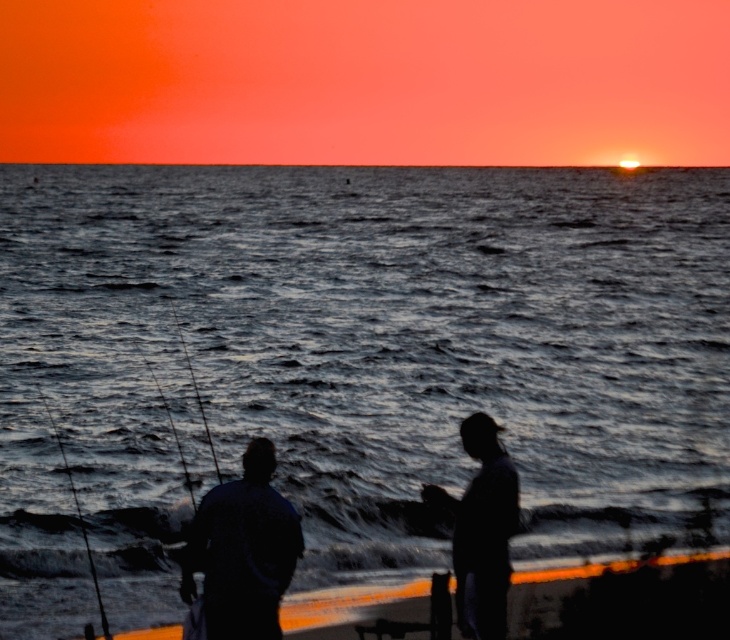
You are a photographer trying to capture the two fishing rods in the scene. Which of the two rods, the smooth black rod at left or the metallic fishing pole at left, appears closer to you?

The smooth black rod at left appears closer to the viewer than the metallic fishing pole at left.